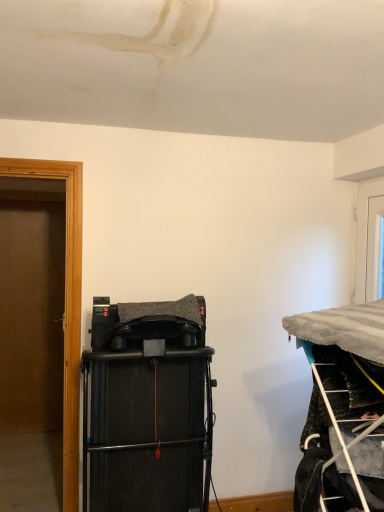
Question: Is point (382, 420) closer or farther from the camera than point (200, 455)?

Choices:
 (A) farther
 (B) closer

Answer: (B)

Question: In the image, is white plastic ladder at lower right positioned in front of or behind black matte speaker at center?

Choices:
 (A) front
 (B) behind

Answer: (A)

Question: Which is nearer to the white plastic ladder at lower right?

Choices:
 (A) white glossy door at upper right
 (B) metallic wire rack at right
 (C) black matte speaker at center

Answer: (B)

Question: Which object is the closest to the black matte speaker at center?

Choices:
 (A) white glossy door at upper right
 (B) metallic wire rack at right
 (C) white plastic ladder at lower right

Answer: (B)